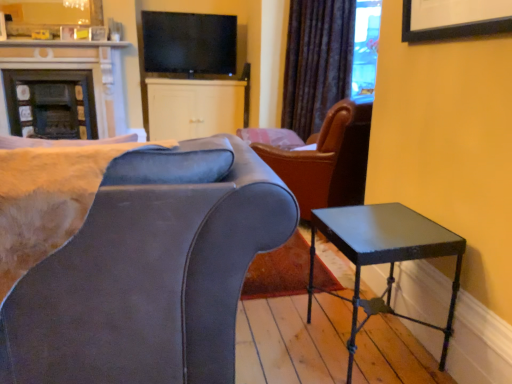
Question: Is velvet dark brown curtain at upper center bigger than suede-like gray chair at left?

Choices:
 (A) no
 (B) yes

Answer: (A)

Question: Is the position of velvet dark brown curtain at upper center more distant than that of suede-like gray chair at left?

Choices:
 (A) no
 (B) yes

Answer: (B)

Question: From the image's perspective, is velvet dark brown curtain at upper center on suede-like gray chair at left?

Choices:
 (A) no
 (B) yes

Answer: (B)

Question: Is velvet dark brown curtain at upper center smaller than suede-like gray chair at left?

Choices:
 (A) yes
 (B) no

Answer: (A)

Question: Does velvet dark brown curtain at upper center come in front of suede-like gray chair at left?

Choices:
 (A) no
 (B) yes

Answer: (A)

Question: From a real-world perspective, does velvet dark brown curtain at upper center sit lower than suede-like gray chair at left?

Choices:
 (A) yes
 (B) no

Answer: (B)

Question: Could you tell me if suede-like gray chair at left is facing velvet dark brown curtain at upper center?

Choices:
 (A) no
 (B) yes

Answer: (B)

Question: Is suede-like gray chair at left facing away from velvet dark brown curtain at upper center?

Choices:
 (A) no
 (B) yes

Answer: (A)

Question: Is suede-like gray chair at left positioned beyond the bounds of velvet dark brown curtain at upper center?

Choices:
 (A) no
 (B) yes

Answer: (B)

Question: Does suede-like gray chair at left have a greater width compared to velvet dark brown curtain at upper center?

Choices:
 (A) yes
 (B) no

Answer: (A)

Question: Can you confirm if suede-like gray chair at left is positioned to the right of velvet dark brown curtain at upper center?

Choices:
 (A) yes
 (B) no

Answer: (B)

Question: Considering the relative positions of suede-like gray chair at left and velvet dark brown curtain at upper center in the image provided, is suede-like gray chair at left to the left of velvet dark brown curtain at upper center from the viewer's perspective?

Choices:
 (A) no
 (B) yes

Answer: (B)

Question: Is metallic black side table at lower right smaller than white matte cabinet at center?

Choices:
 (A) no
 (B) yes

Answer: (B)